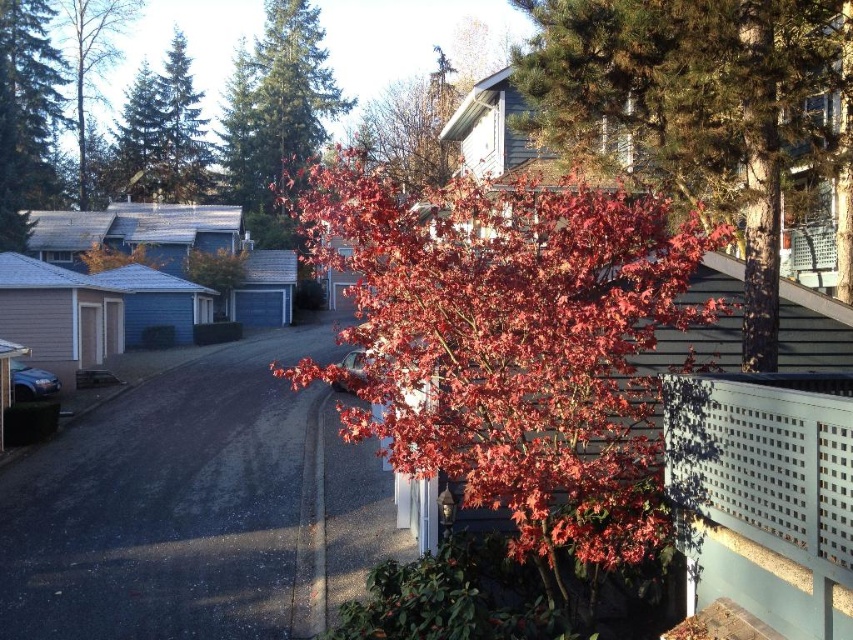
You are standing at the edge of the dark asphalt driveway at lower left and want to look up at the green textured pine tree at upper left. Which object will you see first as you tilt your head upward?

The green textured pine tree at upper left will be seen first because it is taller than the dark asphalt driveway at lower left.

You are a delivery person trying to park a van that is 2 meters wide. You see the dark asphalt driveway at lower left and the green textured pine tree at upper left. Can the driveway accommodate your van?

The dark asphalt driveway at lower left is narrower than the green textured pine tree at upper left, so it might not be wide enough for a 2 meter wide van. Check the driveway width before attempting to park.

You are a delivery person who needs to park your 5.5 meter long delivery van on the dark asphalt driveway at lower left. The shiny green pine tree at upper left is in the way. Can you park the van there without hitting the tree?

The dark asphalt driveway at lower left and the shiny green pine tree at upper left are 33.67 meters apart from each other. Since the distance between them is greater than the van length of 5.5 meters, the van can be parked there without hitting the tree.